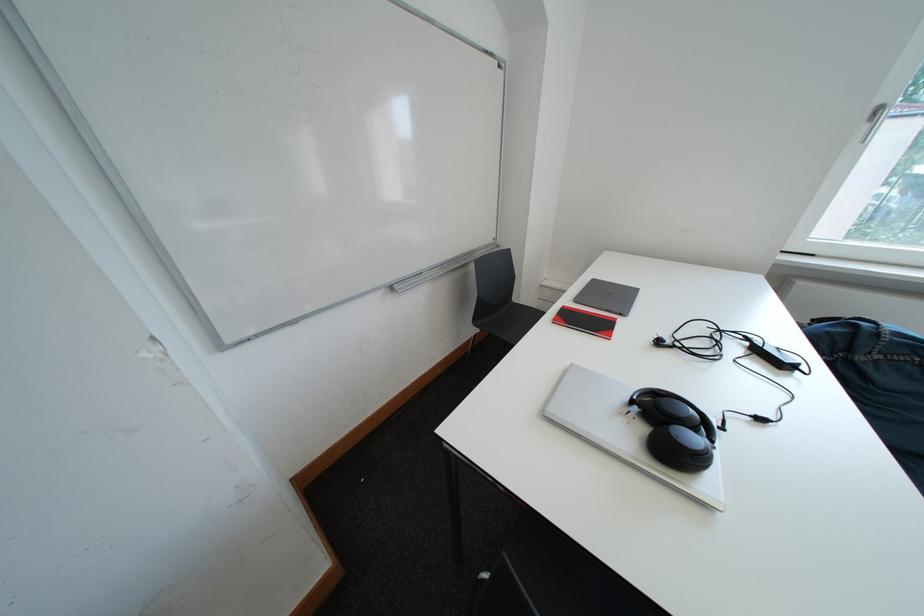
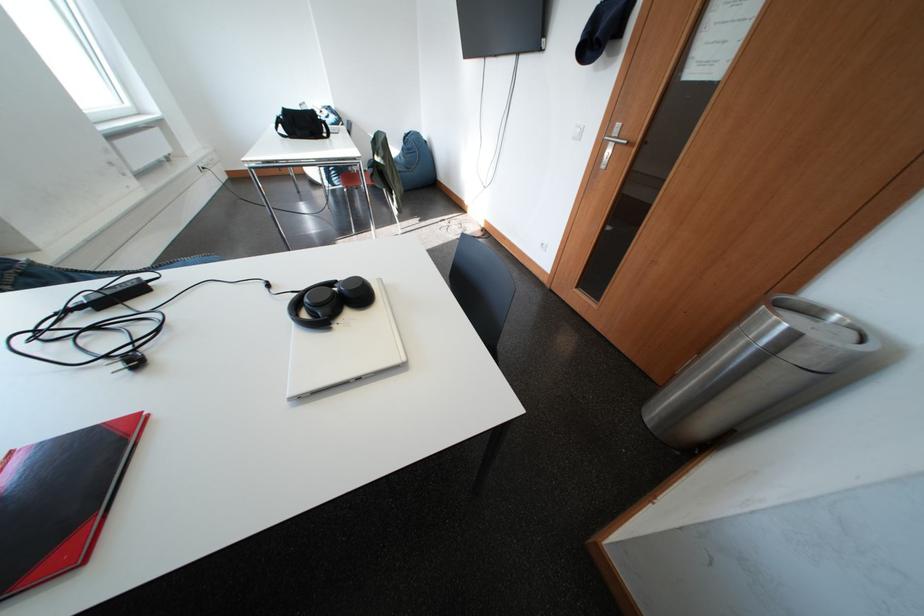
Find the pixel in the second image that matches point 735,424 in the first image.

(304, 294)